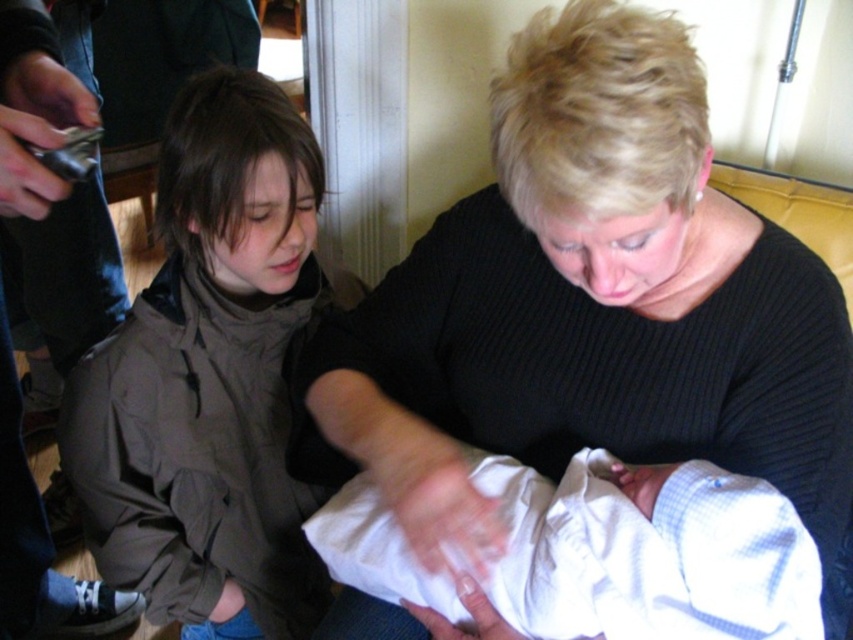
Consider the image. Which is more to the right, brown matte jacket at left or white soft cloth at center?

From the viewer's perspective, white soft cloth at center appears more on the right side.

Between brown matte jacket at left and white soft cloth at center, which one has more height?

With more height is brown matte jacket at left.

The height and width of the screenshot is (640, 853). Identify the location of brown matte jacket at left. (210, 380).

Who is more forward, (344, 602) or (650, 483)?

Positioned in front is point (650, 483).

Which is below, black ribbed sweater at center or white soft cloth at center?

white soft cloth at center is lower down.

The width and height of the screenshot is (853, 640). Identify the location of black ribbed sweater at center. (589, 305).

Locate an element on the screen. black ribbed sweater at center is located at coordinates (589, 305).

Which is more to the right, black ribbed sweater at center or brown matte jacket at left?

black ribbed sweater at center

This screenshot has width=853, height=640. In order to click on black ribbed sweater at center in this screenshot , I will do `click(589, 305)`.

Where is `black ribbed sweater at center`? black ribbed sweater at center is located at coordinates (589, 305).